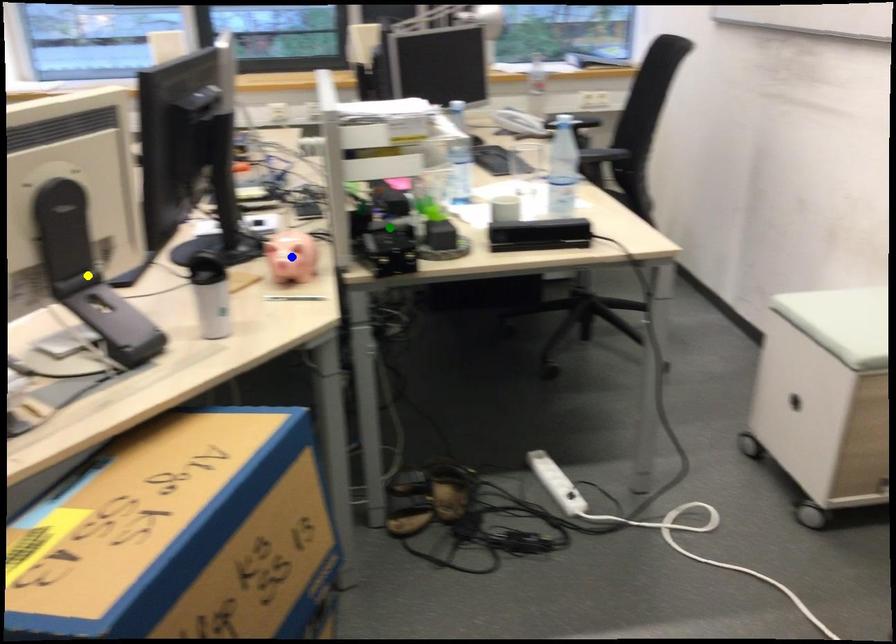
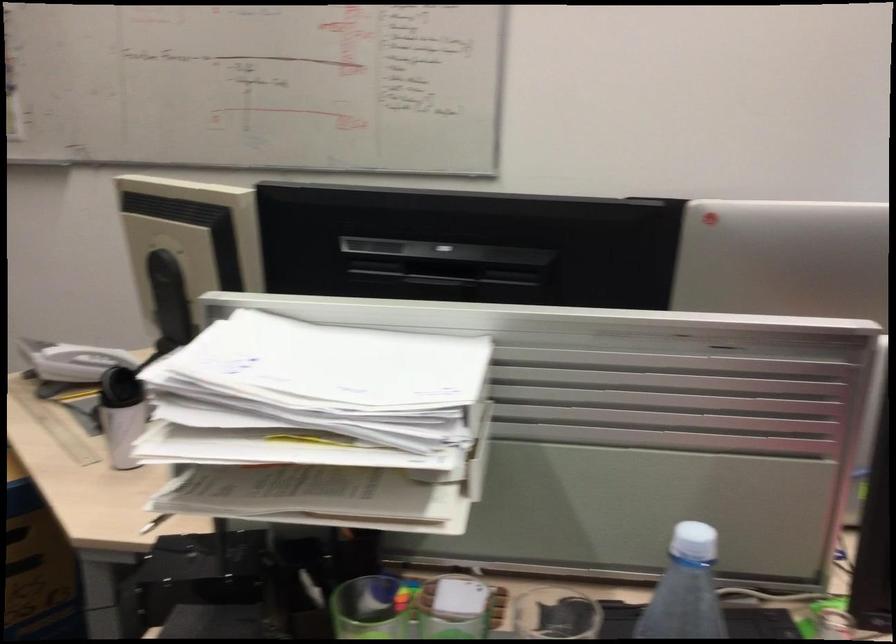
I am providing you with two images of the same scene from different viewpoints. Three points are marked in image1. Which point corresponds to a part or object that is occluded in image2?In image1, three points are marked. Which of them correspond to a part or object that is occluded in image2?Among the three points shown in image1, which one corresponds to a part or object that is no longer visible due to occlusion in image2?

blue point, yellow point